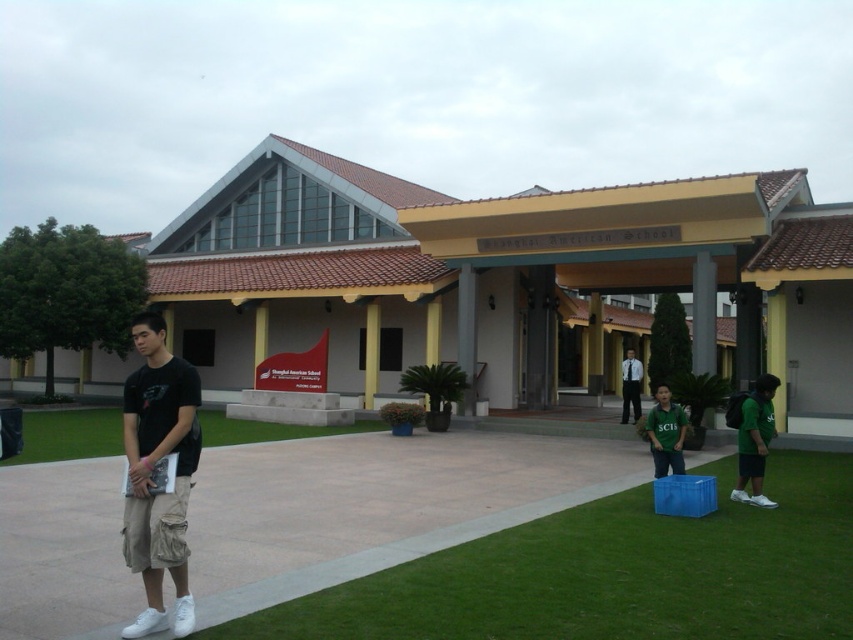
Between green matte shirt at lower right and green matte shirt at center, which one has more height?

With more height is green matte shirt at lower right.

Can you confirm if green matte shirt at lower right is positioned to the right of green matte shirt at center?

Yes, green matte shirt at lower right is to the right of green matte shirt at center.

Locate an element on the screen. green matte shirt at lower right is located at coordinates (755, 440).

Is green matte shirt at lower right positioned at the back of white shirt at center?

No, it is in front of white shirt at center.

Is green matte shirt at lower right closer to the viewer compared to white shirt at center?

Yes, it is in front of white shirt at center.

Locate an element on the screen. This screenshot has width=853, height=640. green matte shirt at lower right is located at coordinates (755, 440).

This screenshot has height=640, width=853. I want to click on green matte shirt at lower right, so click(755, 440).

Can you confirm if green grass at lower right is smaller than green grass at lower left?

Correct, green grass at lower right occupies less space than green grass at lower left.

Is green grass at lower right above green grass at lower left?

Yes.

Where is `green grass at lower right`? The height and width of the screenshot is (640, 853). green grass at lower right is located at coordinates (613, 573).

Identify the location of green grass at lower right. (613, 573).